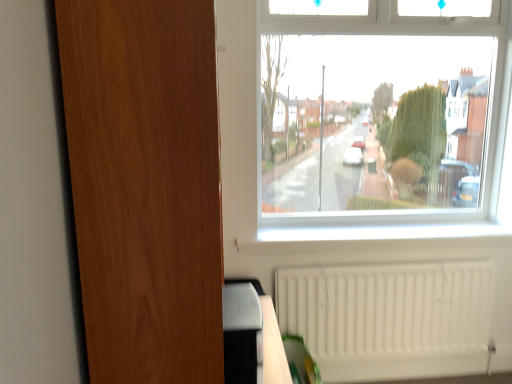
Image resolution: width=512 pixels, height=384 pixels. What do you see at coordinates (390, 318) in the screenshot? I see `white matte radiator at lower right` at bounding box center [390, 318].

Identify the location of white matte radiator at lower right. (390, 318).

What do you see at coordinates (145, 186) in the screenshot? The image size is (512, 384). I see `wooden screen door at left` at bounding box center [145, 186].

Find the location of a particular element. Image resolution: width=512 pixels, height=384 pixels. wooden screen door at left is located at coordinates (145, 186).

What is the approximate height of wooden screen door at left?

It is 1.55 meters.

This screenshot has height=384, width=512. What are the coordinates of `white matte radiator at lower right` in the screenshot? It's located at (390, 318).

Looking at this image, considering the relative positions of wooden screen door at left and white matte radiator at lower right in the image provided, is wooden screen door at left to the right of white matte radiator at lower right from the viewer's perspective?

In fact, wooden screen door at left is to the left of white matte radiator at lower right.

Does wooden screen door at left lie behind white matte radiator at lower right?

No, wooden screen door at left is closer to the viewer.

Considering the points (73, 184) and (481, 278), which point is in front, point (73, 184) or point (481, 278)?

The point (73, 184) is more forward.

From the image's perspective, would you say wooden screen door at left is shown under white matte radiator at lower right?

No, from the image's perspective, wooden screen door at left is not beneath white matte radiator at lower right.

From a real-world perspective, is wooden screen door at left physically above white matte radiator at lower right?

Yes, from a real-world perspective, wooden screen door at left is on top of white matte radiator at lower right.

Can you confirm if wooden screen door at left is thinner than white matte radiator at lower right?

In fact, wooden screen door at left might be wider than white matte radiator at lower right.

Considering the relative sizes of wooden screen door at left and white matte radiator at lower right in the image provided, is wooden screen door at left taller than white matte radiator at lower right?

Indeed, wooden screen door at left has a greater height compared to white matte radiator at lower right.

Who is bigger, wooden screen door at left or white matte radiator at lower right?

With larger size is wooden screen door at left.

Is wooden screen door at left surrounding white matte radiator at lower right?

No, white matte radiator at lower right is not inside wooden screen door at left.

Can you see wooden screen door at left touching white matte radiator at lower right?

No, wooden screen door at left is not with white matte radiator at lower right.

Is wooden screen door at left oriented away from white matte radiator at lower right?

That's not correct — wooden screen door at left is not looking away from white matte radiator at lower right.

What's the angular difference between wooden screen door at left and white matte radiator at lower right's facing directions?

The angular difference between wooden screen door at left and white matte radiator at lower right is 90.9 degrees.

Looking at this image, how much distance is there between wooden screen door at left and white matte radiator at lower right?

4.99 feet.

You are a GUI agent. You are given a task and a screenshot of the screen. Output one action in this format:
    pyautogui.click(x=<x>, y=<y>)
    Task: Click on the radiator directly beneath the wooden screen door at left (from a real-world perspective)
    The width and height of the screenshot is (512, 384).
    Given the screenshot: What is the action you would take?
    pyautogui.click(x=390, y=318)

Between white matte radiator at lower right and wooden screen door at left, which one appears on the right side from the viewer's perspective?

From the viewer's perspective, white matte radiator at lower right appears more on the right side.

Consider the image. In the image, is white matte radiator at lower right positioned in front of or behind wooden screen door at left?

white matte radiator at lower right is positioned farther from the viewer than wooden screen door at left.

Between point (337, 280) and point (155, 230), which one is positioned behind?

The point (337, 280) is farther.

From the image's perspective, is white matte radiator at lower right under wooden screen door at left?

Yes.

From a real-world perspective, is white matte radiator at lower right located beneath wooden screen door at left?

Yes, from a real-world perspective, white matte radiator at lower right is below wooden screen door at left.

Which of these two, white matte radiator at lower right or wooden screen door at left, is thinner?

With smaller width is white matte radiator at lower right.

Which of these two, white matte radiator at lower right or wooden screen door at left, stands shorter?

Standing shorter between the two is white matte radiator at lower right.

Does white matte radiator at lower right have a smaller size compared to wooden screen door at left?

Correct, white matte radiator at lower right occupies less space than wooden screen door at left.

Which is correct: white matte radiator at lower right is inside wooden screen door at left, or outside of it?

white matte radiator at lower right is not enclosed by wooden screen door at left.

Is white matte radiator at lower right not close to wooden screen door at left?

Yes.

Is white matte radiator at lower right positioned with its back to wooden screen door at left?

white matte radiator at lower right is not turned away from wooden screen door at left.

Measure the distance between white matte radiator at lower right and wooden screen door at left.

white matte radiator at lower right and wooden screen door at left are 1.52 meters apart.

Image resolution: width=512 pixels, height=384 pixels. Identify the location of radiator on the right of wooden screen door at left. (390, 318).

The height and width of the screenshot is (384, 512). What are the coordinates of `screen door that appears in front of the white matte radiator at lower right` in the screenshot? It's located at (145, 186).

Image resolution: width=512 pixels, height=384 pixels. I want to click on radiator behind the wooden screen door at left, so click(x=390, y=318).